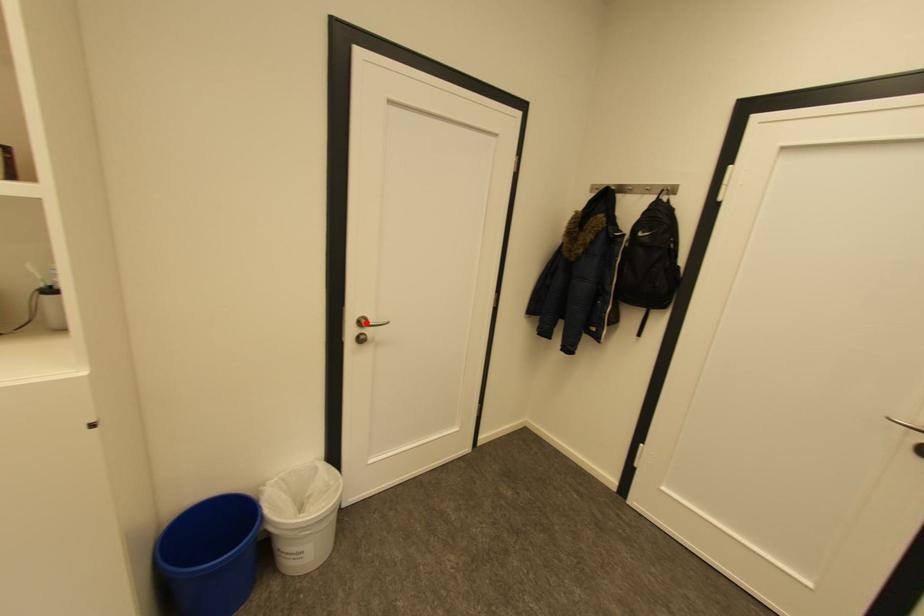
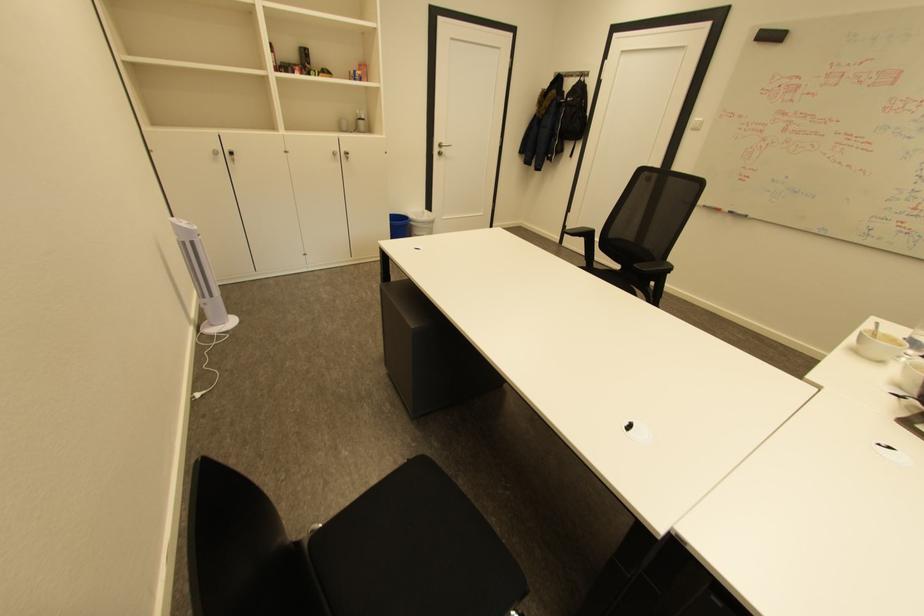
Question: I am providing you with two images of the same scene from different viewpoints. Given a red point in image1, look at the same physical point in image2. Is it:

Choices:
 (A) Closer to the viewpoint
 (B) Farther from the viewpoint

Answer: (A)